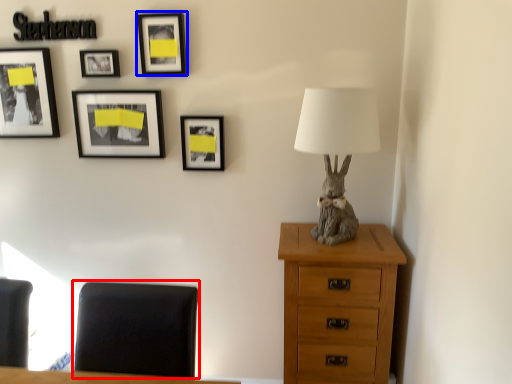
Question: Which of the following is the closest to the observer, furniture (highlighted by a red box) or picture frame (highlighted by a blue box)?

Choices:
 (A) furniture
 (B) picture frame

Answer: (A)